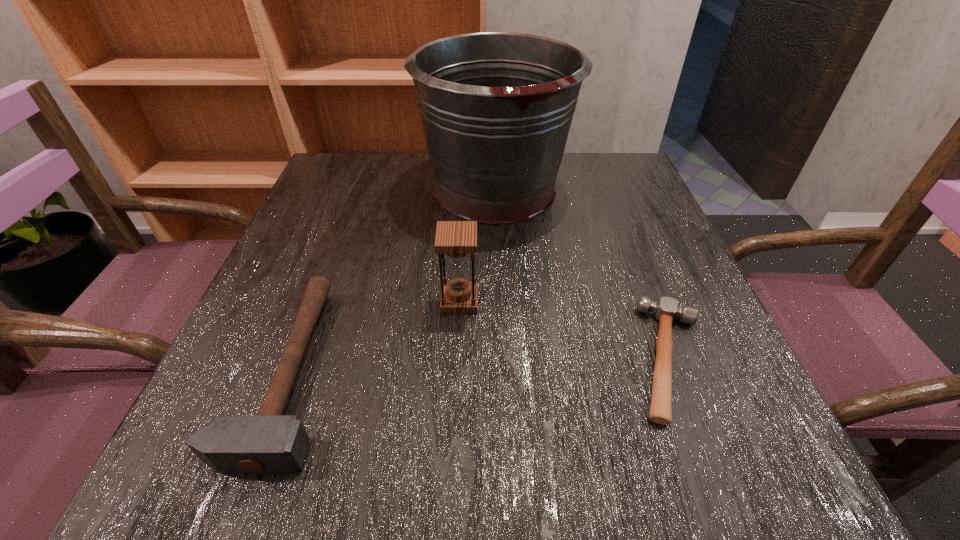
Image resolution: width=960 pixels, height=540 pixels. What are the coordinates of `vacant region at the far left corner of the desktop` in the screenshot? It's located at (357, 192).

At what (x,y) coordinates should I click in order to perform the action: click on vacant space at the far right corner. Please return your answer as a coordinate pair (x, y). The image size is (960, 540). Looking at the image, I should click on (603, 186).

This screenshot has width=960, height=540. I want to click on unoccupied position between the farthest object and the hourglass, so click(477, 245).

This screenshot has width=960, height=540. What are the coordinates of `free space that is in between the shortest object and the farthest object` in the screenshot? It's located at (583, 274).

This screenshot has width=960, height=540. What are the coordinates of `vacant space that is in between the taller hammer and the rightmost object` in the screenshot? It's located at (479, 365).

I want to click on vacant area between the right hammer and the second tallest object, so click(x=565, y=329).

In order to click on free space between the taller hammer and the second tallest object in this screenshot , I will do pyautogui.click(x=373, y=335).

Find the location of a particular element. free spot between the farthest object and the hourglass is located at coordinates (477, 245).

What are the coordinates of `blank region between the farthest object and the shorter hammer` in the screenshot? It's located at 583,274.

I want to click on vacant space in between the right hammer and the second tallest object, so click(x=565, y=329).